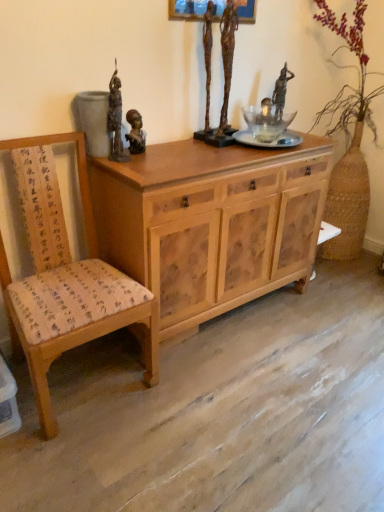
Where is `free location in front of wooden chair with fabric cushion at left`? free location in front of wooden chair with fabric cushion at left is located at coordinates (85, 464).